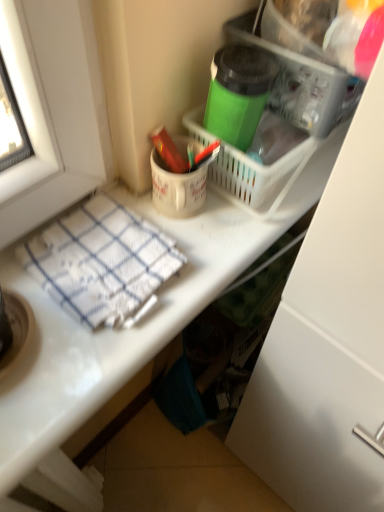
Question: Is matte red crayon at upper center located outside white woven towel at lower left?

Choices:
 (A) yes
 (B) no

Answer: (A)

Question: From the image's perspective, would you say matte red crayon at upper center is positioned over white woven towel at lower left?

Choices:
 (A) no
 (B) yes

Answer: (B)

Question: Considering the relative sizes of matte red crayon at upper center and white woven towel at lower left in the image provided, is matte red crayon at upper center shorter than white woven towel at lower left?

Choices:
 (A) yes
 (B) no

Answer: (B)

Question: Does matte red crayon at upper center have a greater height compared to white woven towel at lower left?

Choices:
 (A) no
 (B) yes

Answer: (B)

Question: Considering the relative sizes of matte red crayon at upper center and white woven towel at lower left in the image provided, is matte red crayon at upper center thinner than white woven towel at lower left?

Choices:
 (A) yes
 (B) no

Answer: (A)

Question: Is point (264, 58) closer or farther from the camera than point (178, 156)?

Choices:
 (A) closer
 (B) farther

Answer: (A)

Question: Which is correct: green matte thermos at upper center is inside matte red crayon at upper center, or outside of it?

Choices:
 (A) outside
 (B) inside

Answer: (A)

Question: From the image's perspective, is green matte thermos at upper center above or below matte red crayon at upper center?

Choices:
 (A) above
 (B) below

Answer: (A)

Question: In terms of width, does green matte thermos at upper center look wider or thinner when compared to matte red crayon at upper center?

Choices:
 (A) wide
 (B) thin

Answer: (A)

Question: Relative to green matte thermos at upper center, is matte red crayon at upper center in front or behind?

Choices:
 (A) behind
 (B) front

Answer: (A)

Question: In the image, is matte red crayon at upper center on the left side or the right side of green matte thermos at upper center?

Choices:
 (A) right
 (B) left

Answer: (B)

Question: Is point (157, 139) positioned closer to the camera than point (223, 122)?

Choices:
 (A) farther
 (B) closer

Answer: (A)

Question: From the image's perspective, is matte red crayon at upper center above or below green matte thermos at upper center?

Choices:
 (A) below
 (B) above

Answer: (A)

Question: Is green matte thermos at upper center taller or shorter than white woven towel at lower left?

Choices:
 (A) short
 (B) tall

Answer: (B)

Question: From the image's perspective, relative to white woven towel at lower left, is green matte thermos at upper center above or below?

Choices:
 (A) above
 (B) below

Answer: (A)